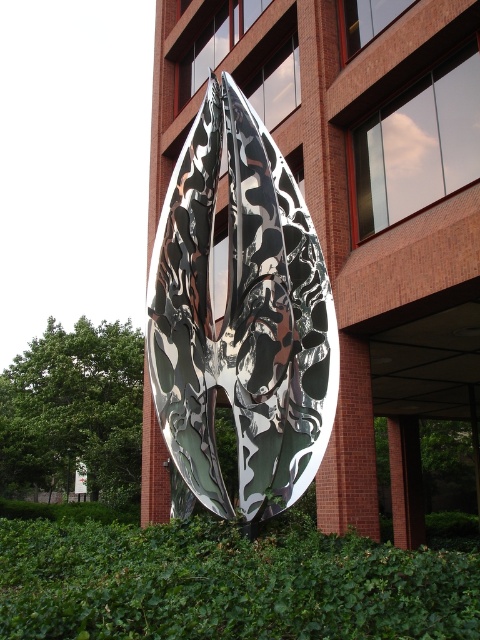
Which is above, green leafy hedge at center or green leafy hedge at lower left?

green leafy hedge at center

Between point (339, 611) and point (7, 496), which one is positioned behind?

Point (7, 496)

Is point (187, 540) farther from viewer compared to point (36, 449)?

That is False.

At what (x,y) coordinates should I click in order to perform the action: click on green leafy hedge at center. Please return your answer as a coordinate pair (x, y). Looking at the image, I should click on (226, 584).

Can you confirm if metallic reflective leaf at center is shorter than green leafy hedge at lower left?

Indeed, metallic reflective leaf at center has a lesser height compared to green leafy hedge at lower left.

Who is higher up, metallic reflective leaf at center or green leafy hedge at lower left?

metallic reflective leaf at center

Is point (180, 486) farther from viewer compared to point (36, 349)?

No, (180, 486) is closer to viewer.

You are a GUI agent. You are given a task and a screenshot of the screen. Output one action in this format:
    pyautogui.click(x=<x>, y=<y>)
    Task: Click on the metallic reflective leaf at center
    
    Given the screenshot: What is the action you would take?
    pyautogui.click(x=240, y=320)

Is metallic reflective leaf at center bigger than green leafy hedge at center?

Yes.

Is metallic reflective leaf at center wider than green leafy hedge at center?

Correct, the width of metallic reflective leaf at center exceeds that of green leafy hedge at center.

Does point (178, 195) come farther from viewer compared to point (175, 550)?

Yes, point (178, 195) is farther from viewer.

Identify the location of metallic reflective leaf at center. (240, 320).